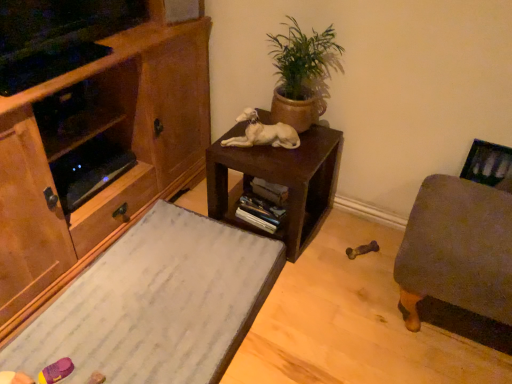
Identify the location of empty space that is ontop of brown matte table at center (from a real-world perspective). The height and width of the screenshot is (384, 512). (291, 143).